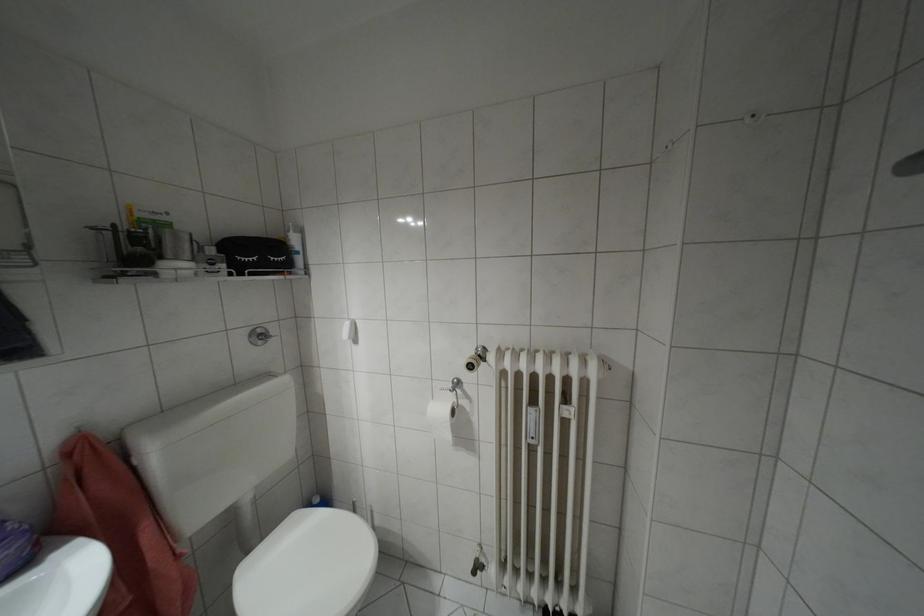
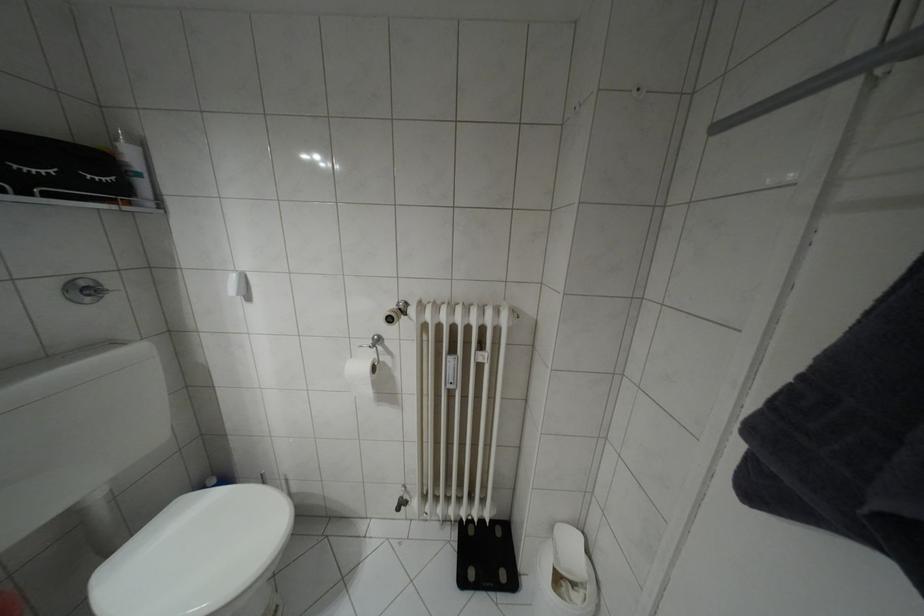
Question: In a continuous first-person perspective shot, in which direction is the camera moving?

Choices:
 (A) Left
 (B) Right
 (C) Forward
 (D) Backward

Answer: (B)